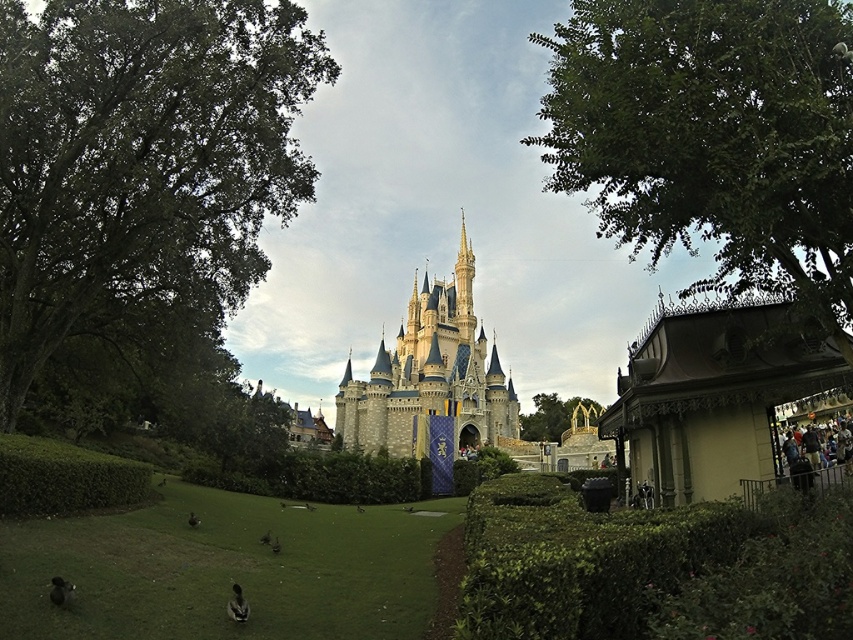
Which is more to the left, green leafy hedge at lower right or stone castle at center?

From the viewer's perspective, stone castle at center appears more on the left side.

Is green leafy hedge at lower right smaller than stone castle at center?

Yes.

Measure the distance between point (614, 536) and camera.

They are 84.93 meters apart.

Identify the location of green leafy hedge at lower right. (654, 566).

Between green leafy hedge at lower right and green leafy hedge at lower left, which one is positioned higher?

green leafy hedge at lower left

Is green leafy hedge at lower right wider than green leafy hedge at lower left?

Correct, the width of green leafy hedge at lower right exceeds that of green leafy hedge at lower left.

This screenshot has height=640, width=853. Describe the element at coordinates (654, 566) in the screenshot. I see `green leafy hedge at lower right` at that location.

Identify the location of green leafy hedge at lower right. (654, 566).

Does stone castle at center have a greater width compared to green leafy hedge at lower left?

Yes.

Between stone castle at center and green leafy hedge at lower left, which one has less height?

green leafy hedge at lower left

Who is more distant from viewer, (375, 387) or (61, 504)?

Point (375, 387)

Where is `stone castle at center`? stone castle at center is located at coordinates (431, 376).